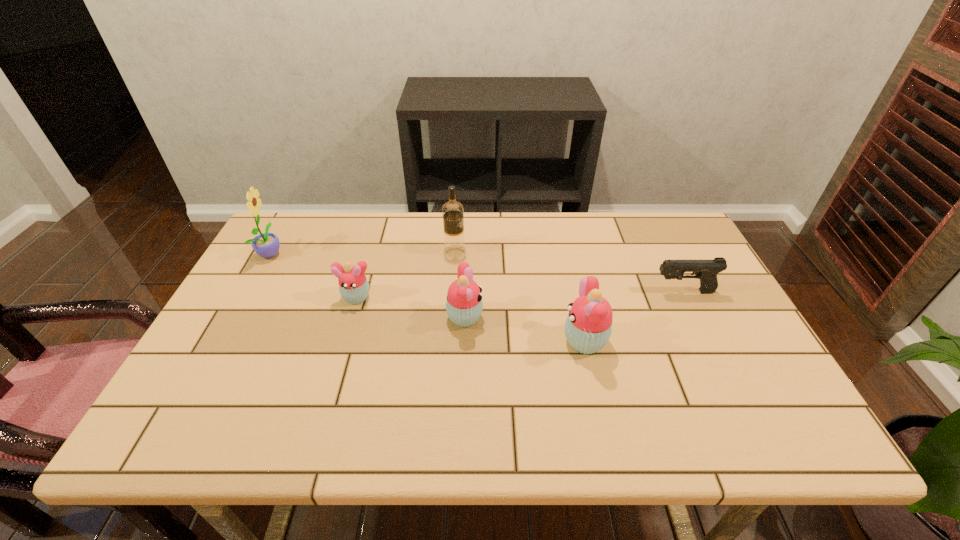
Locate an element on the screen. free area in between the fourth tallest object and the rightmost cupcake is located at coordinates (525, 329).

Find the location of a particular element. free space between the shortest cupcake and the second tallest cupcake is located at coordinates (411, 308).

You are a GUI agent. You are given a task and a screenshot of the screen. Output one action in this format:
    pyautogui.click(x=<x>, y=<y>)
    Task: Click on the vacant space that is in between the third shortest object and the fifth object from left to right
    The height and width of the screenshot is (540, 960).
    Given the screenshot: What is the action you would take?
    pyautogui.click(x=525, y=329)

The width and height of the screenshot is (960, 540). In order to click on unoccupied area between the fifth object from right to left and the sunflower in this screenshot , I will do [x=314, y=275].

Identify the location of vacant area between the rightmost object and the fifth object from left to right. The width and height of the screenshot is (960, 540). pyautogui.click(x=635, y=316).

Find the location of a particular element. free space that is in between the vodka and the leftmost cupcake is located at coordinates (405, 274).

Where is `free area in between the second object from left to right and the vodka`? The width and height of the screenshot is (960, 540). free area in between the second object from left to right and the vodka is located at coordinates (405, 274).

The height and width of the screenshot is (540, 960). Identify the location of object that is the third closest to the second object from right to left. (454, 245).

Select which object is the fourth closest to the vodka. Please provide its 2D coordinates. Your answer should be formatted as a tuple, i.e. [(x, y)], where the tuple contains the x and y coordinates of a point satisfying the conditions above.

[(266, 245)]

This screenshot has width=960, height=540. I want to click on the third closest cupcake to the vodka, so [588, 327].